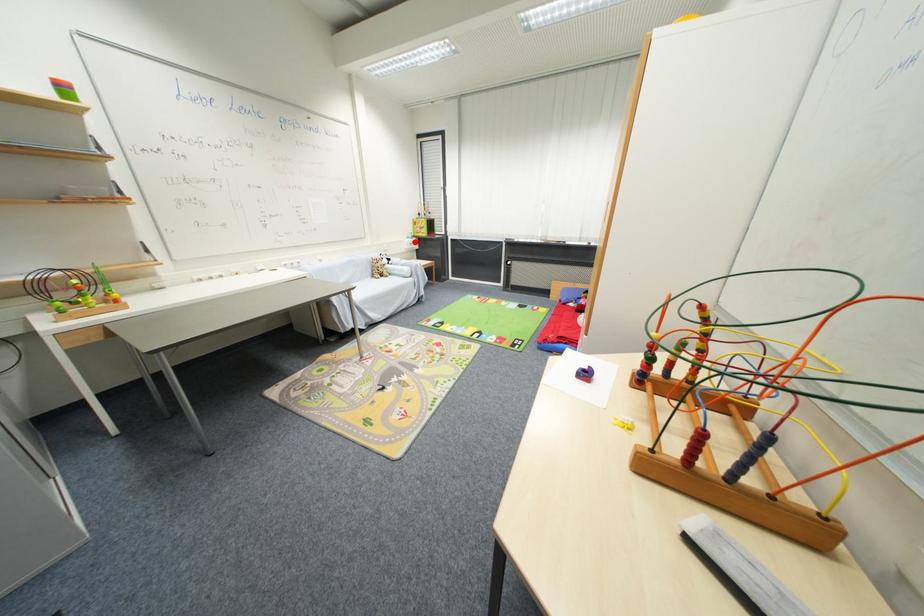
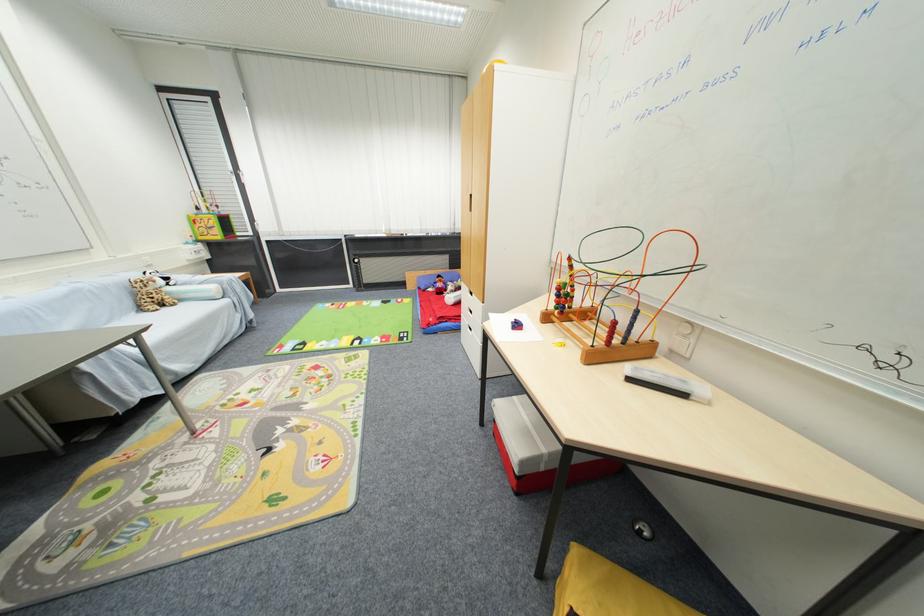
Question: I am providing you with two images of the same scene from different viewpoints. Image1 has a red point marked. In image2, the corresponding 3D location appears at what relative position? Reply with the corresponding letter.

Choices:
 (A) Closer
 (B) Farther

Answer: (B)